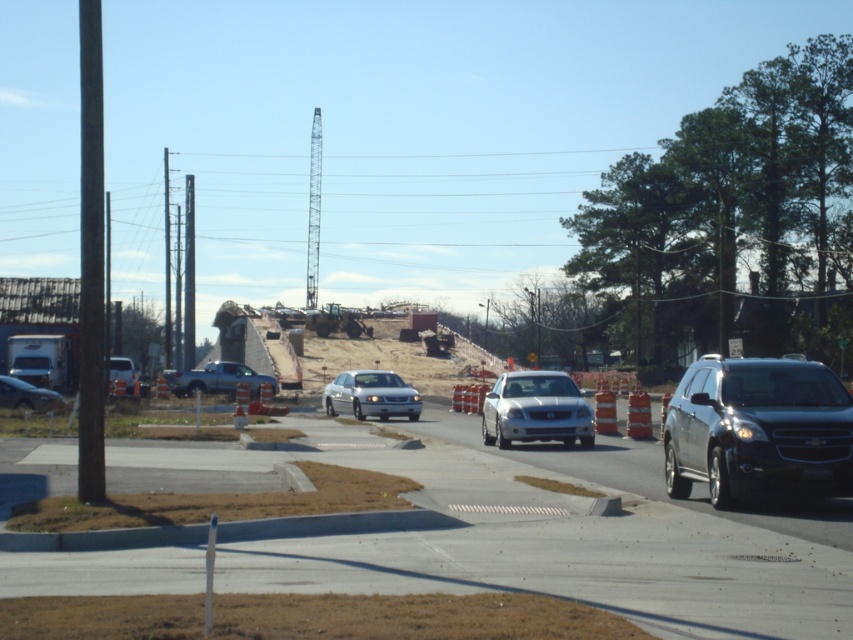
You are a pedestrian crossing the road and see the silver metallic sedan at center and the matte silver sedan at left. Which car is closer to your right side?

The silver metallic sedan at center is to the right of the matte silver sedan at left, so it is closer to your right side.

You are a traffic controller observing the road intersection scene. There is a point marked at coordinates (537,410). What object is located at that point?

The point at coordinates (537,410) indicates the silver metallic sedan at center.